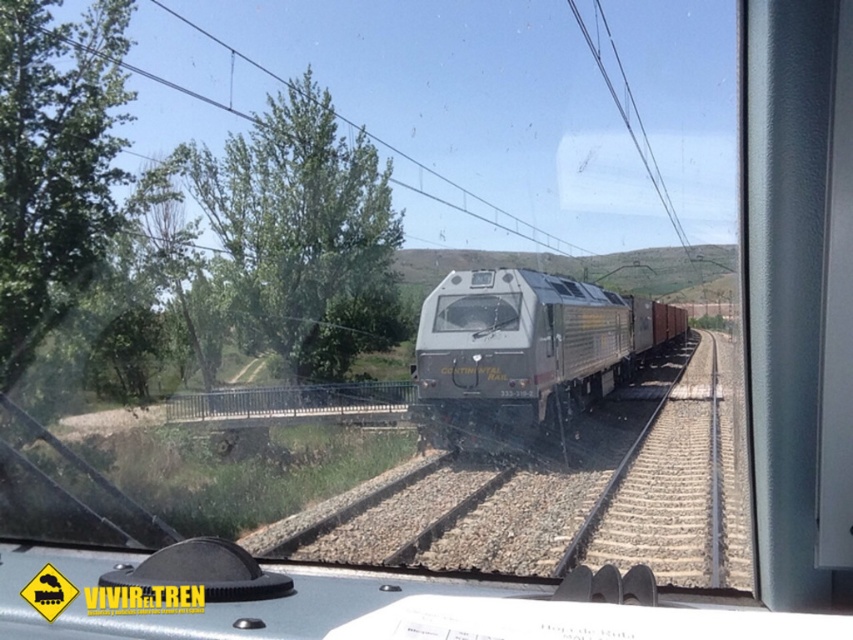
You are a passenger sitting in the train and looking out the window. You notice two green leafy trees outside. Which tree, the green leafy tree at upper left or the green leafy tree at left, is positioned more to the right from your viewpoint?

The green leafy tree at upper left is positioned to the right of the green leafy tree at left, so the green leafy tree at upper left is more to the right.

You are a passenger on the train and want to take a photo of the green leafy tree at upper left. The train window is 1 meter wide. Where should you stand to ensure the entire tree fits in your photo?

To capture the entire green leafy tree at upper left in your photo, you should position yourself so that the tree is centered within the window. Since the tree is located at coordinates approximately 0.367 on the horizontal axis and 0.355 on the vertical axis, aligning the center of the window with these coordinates will ensure the tree is fully framed within the 1 meter wide window.